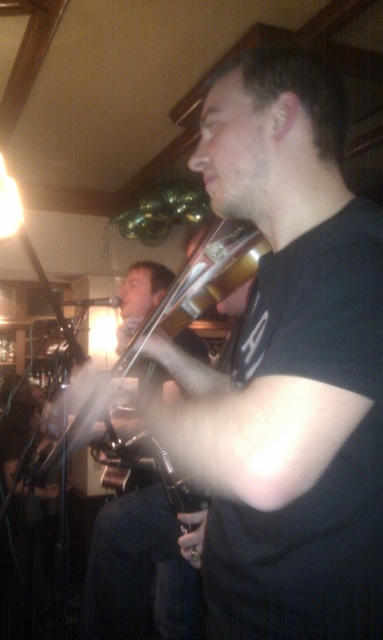
Question: Can you confirm if shiny silver cello at center is bigger than shiny silver violin at center?

Choices:
 (A) no
 (B) yes

Answer: (B)

Question: Which of the following is the closest to the observer?

Choices:
 (A) (234, 253)
 (B) (119, 298)

Answer: (A)

Question: Among these objects, which one is nearest to the camera?

Choices:
 (A) shiny silver cello at center
 (B) shiny silver violin at center

Answer: (B)

Question: Can you confirm if shiny silver cello at center is positioned to the left of shiny silver violin at center?

Choices:
 (A) no
 (B) yes

Answer: (A)

Question: Which of the following is the farthest from the observer?

Choices:
 (A) (201, 259)
 (B) (111, 554)

Answer: (B)

Question: Does shiny silver cello at center lie behind shiny silver violin at center?

Choices:
 (A) no
 (B) yes

Answer: (B)